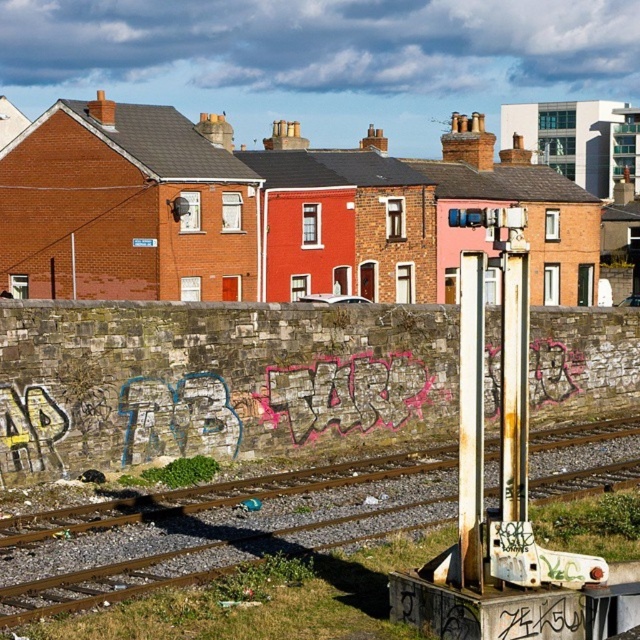
Question: Is rusty metal train track at lower center further to camera compared to rusty metal pole at center-right?

Choices:
 (A) yes
 (B) no

Answer: (A)

Question: Is rusty metal train track at lower center positioned at the back of rusty metal pole at center-right?

Choices:
 (A) yes
 (B) no

Answer: (A)

Question: Which point appears closest to the camera in this image?

Choices:
 (A) (460, 461)
 (B) (221, 496)

Answer: (A)

Question: Is rusty metal train track at lower center above rusty metal pole at center-right?

Choices:
 (A) no
 (B) yes

Answer: (A)